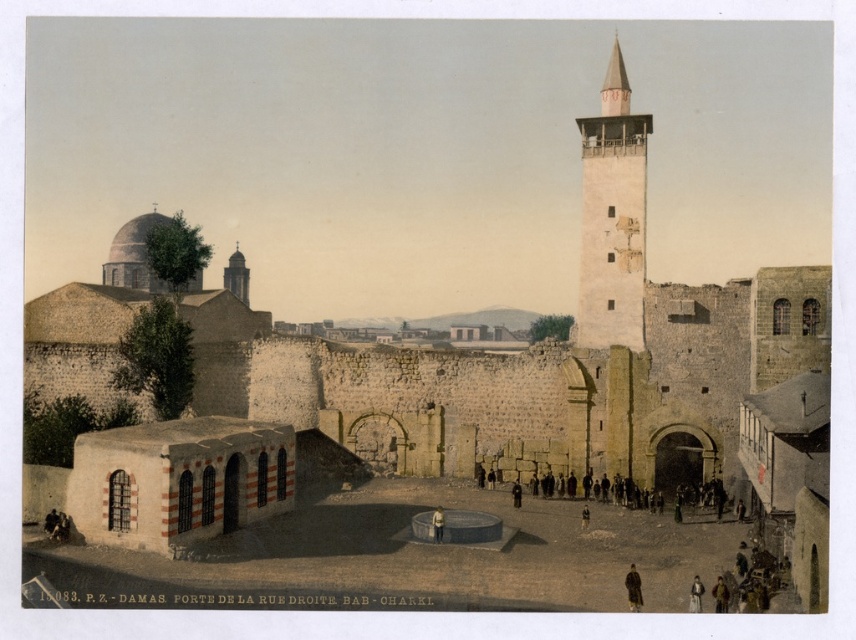
You are standing at the entrance of the fortification and want to take a photo that includes both the point at coordinates point (629, 588) and point (700, 605). Which point should you focus on first to ensure both are in focus?

You should focus on point (629, 588) first because it is closer to the camera than point (700, 605). This ensures that both points will be within the depth of field and in focus.

You are a traveler who just arrived at the courtyard and see both the brown fur coat at lower right and the brown leather jacket at lower right. Which one is covering the other?

The brown fur coat at lower right is positioned over the brown leather jacket at lower right, so it is covering the jacket.